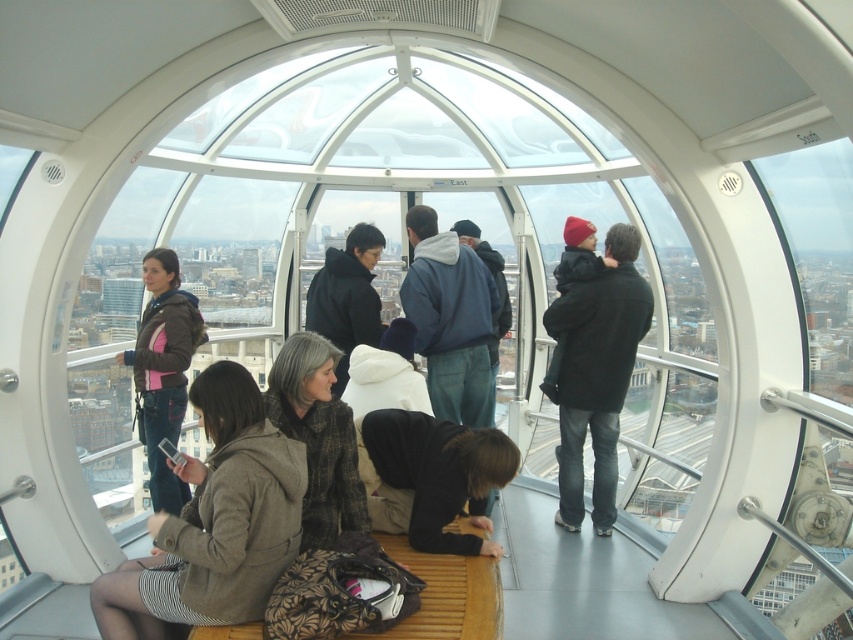
You are inside the observation pod and want to take a photo of the city through the transparent glass window at center without any obstructions. However, there is a matte black coat at center in the way. Can you move the coat to the side to get a clear view?

The transparent glass window at center is larger in size than the matte black coat at center, so you can move the matte black coat at center to the side to get a clear view through the transparent glass window at center.

You are a tour guide leading a group inside the observation pod. You notice two coats near the floor. The brown textured coat at lower left and the dark brown leather jacket at lower center. Can you tell the group which one is wider?

The brown textured coat at lower left is wider than the dark brown leather jacket at lower center.

You are inside the observation pod and want to retrieve your brown textured coat at center. However, the transparent glass window at center is blocking your path. Can you move around the window to reach your coat?

The transparent glass window at center is to the left of the brown textured coat at center, so you can move around to the right side of the window to reach your coat.